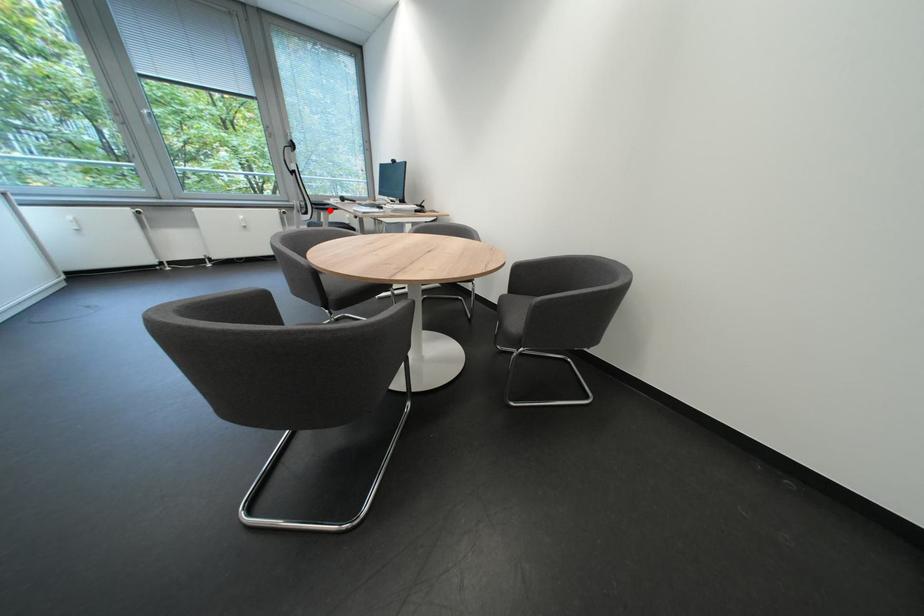
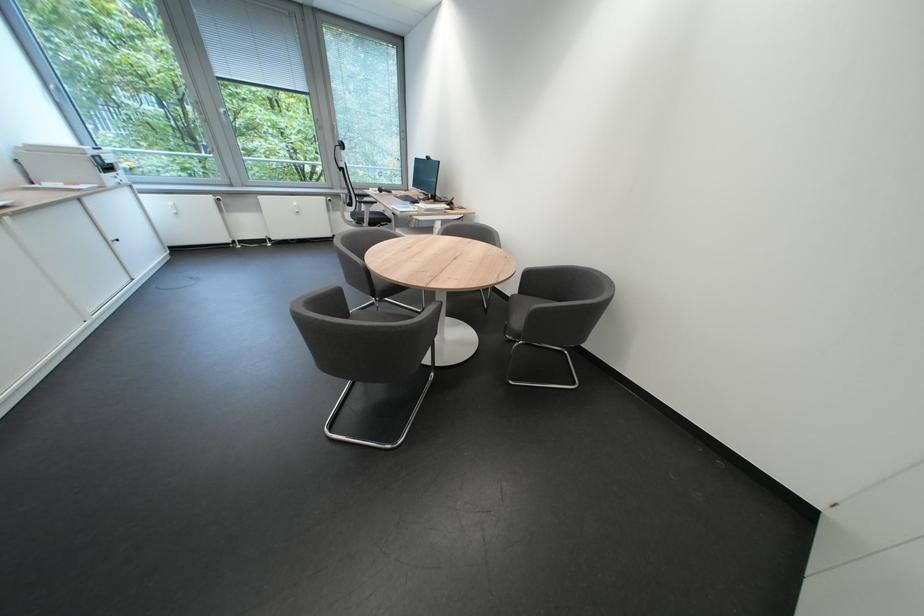
Find the pixel in the second image that matches the highlighted location in the first image.

(372, 204)